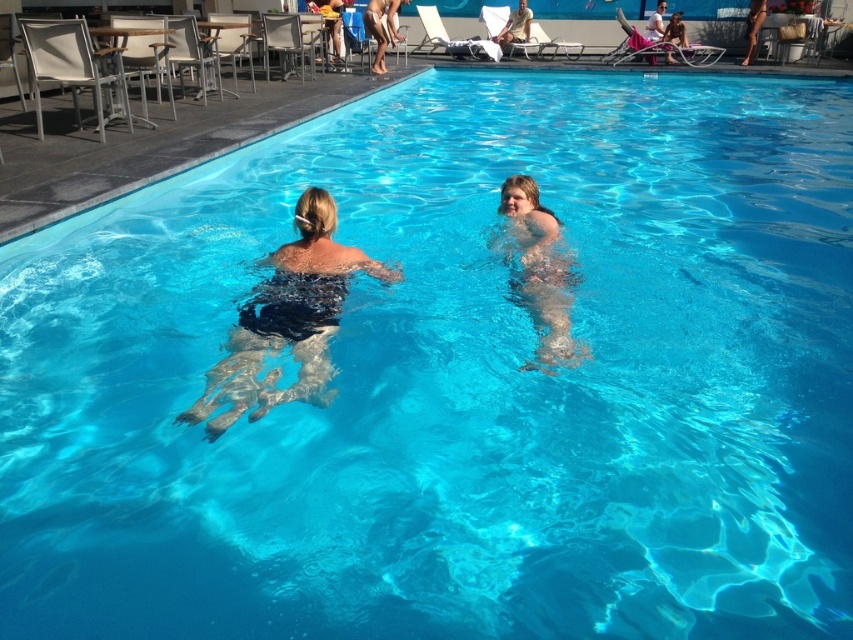
You are standing at the edge of the pool and want to reach the point marked at coordinates point [564,339]. If your maximum comfortable swimming distance is 4 meters, can you safely swim to that point?

The distance of point [564,339] from camera is 3.93 meters, so yes, you can safely swim to that point as it is within your maximum comfortable swimming distance of 4 meters.

In the scene shown: You are standing at the edge of the pool and want to reach the point marked as point (334, 310). There is an obstacle at point (521, 33). Will you pass in front of or behind the obstacle?

Since point (334, 310) is in front of point (521, 33), you will pass in front of the obstacle at point (521, 33) when moving towards your destination.

You are a photographer at the poolside and want to capture both the smooth skin child at center and the matte black bikini at upper center in a single shot. However, you can only focus on one subject clearly. Based on their positions, which subject should you focus on to ensure the other remains somewhat in focus?

The smooth skin child at center is in front of the matte black bikini at upper center. To ensure the matte black bikini at upper center stays somewhat in focus, you should focus on the smooth skin child at center since it is closer to the camera.